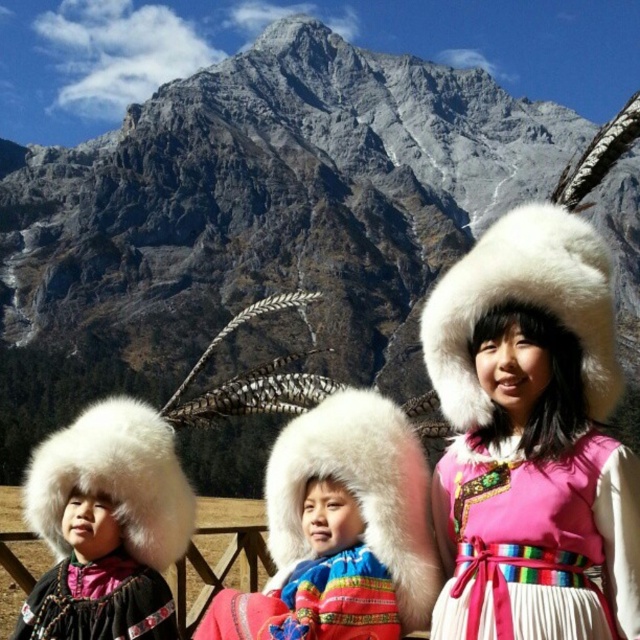
You are a photographer trying to capture a photo of the two white fur hats in the scene. The white fur hat at center and the white fur hat at left are both in your viewfinder. Which one appears taller in the photo?

The white fur hat at center appears taller in the photo because it is much taller than the white fur hat at left according to the description.

Based on the photo, you are a photographer trying to capture a group photo of the three children in the scene. The children are positioned at point (321, 621). You want to ensure that all three children are in focus. Given that your camera has a depth of field that can cover 160 feet, will you need to adjust your camera settings to ensure all children are in focus?

The children are 163.89 feet apart, which exceeds the camera depth of field of 160 feet. Therefore, you will need to adjust your camera settings to ensure all three children are in focus.